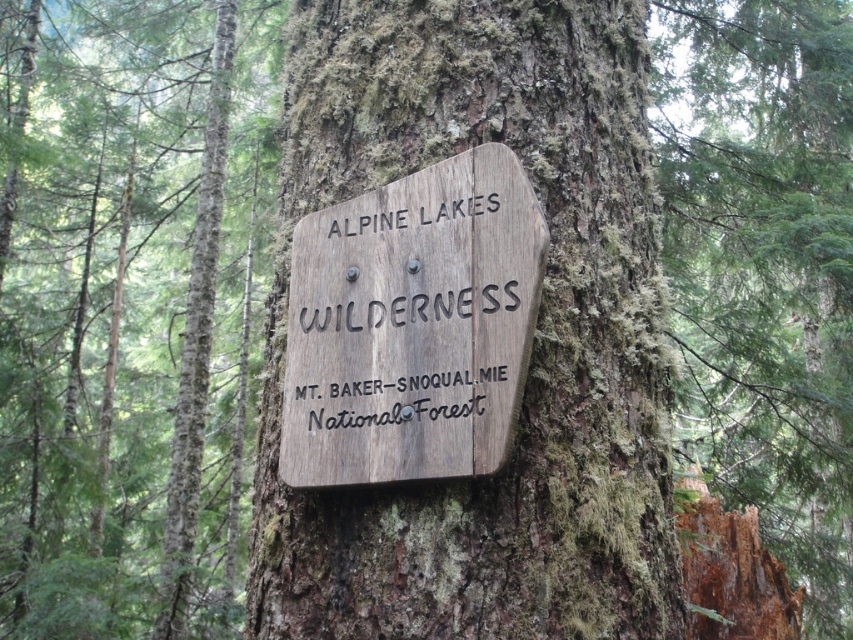
You are standing in the forest and want to take a photo of the weathered wood sign at center. If your camera can focus on objects up to 10 meters away, will it be able to capture the sign clearly?

The weathered wood sign at center is 10.74 meters away from the camera, which is beyond the camera focus range of 10 meters. The camera cannot capture the sign clearly.

You are a hiker who wants to take a photo of the weathered wood sign at center and the brown rough bark at center. Which object should you focus on first if you want to capture both in a single frame without moving the camera? Explain your reasoning based on their positions.

The weathered wood sign at center is positioned on the left side of brown rough bark at center. Since the sign is to the left of the bark, you should focus on the weathered wood sign at center first to ensure both objects are within the camera frame without needing to adjust the camera position.